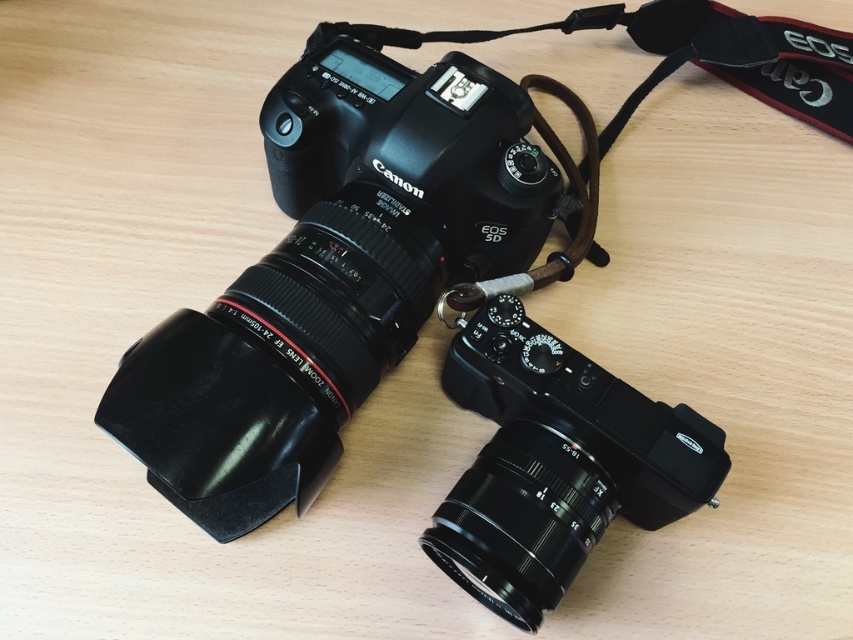
Consider the image. Which is below, black matte camera at center or brown leather strap at upper center?

black matte camera at center

I want to click on black matte camera at center, so click(x=556, y=464).

Does matte black camera at center have a lesser width compared to black matte lens at lower center?

No, matte black camera at center is not thinner than black matte lens at lower center.

Can you confirm if matte black camera at center is positioned below black matte lens at lower center?

Actually, matte black camera at center is above black matte lens at lower center.

Is point (421, 298) less distant than point (535, 532)?

That is False.

Locate an element on the screen. The height and width of the screenshot is (640, 853). matte black camera at center is located at coordinates (332, 276).

Does matte black camera at center have a lesser height compared to black matte camera at center?

Incorrect, matte black camera at center's height does not fall short of black matte camera at center's.

Between matte black camera at center and black matte camera at center, which one is positioned higher?

matte black camera at center

Between point (403, 211) and point (491, 456), which one is positioned in front?

Point (491, 456) is in front.

The height and width of the screenshot is (640, 853). I want to click on matte black camera at center, so click(x=332, y=276).